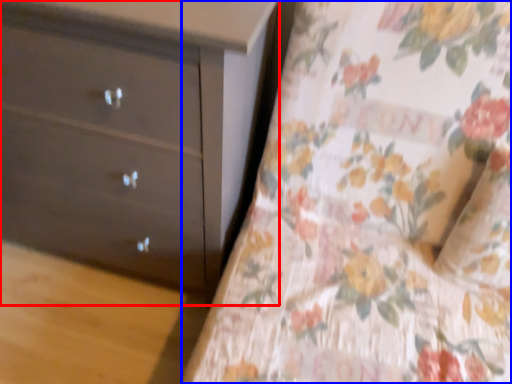
Question: Which object is further to the camera taking this photo, chest of drawers (highlighted by a red box) or sheet (highlighted by a blue box)?

Choices:
 (A) chest of drawers
 (B) sheet

Answer: (A)